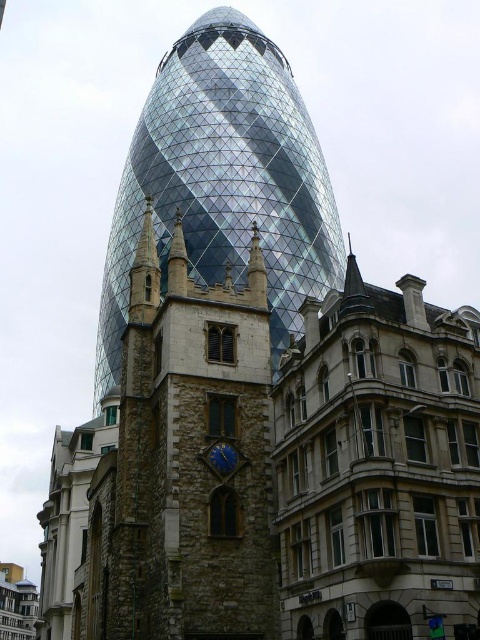
Find the location of a particular element. The height and width of the screenshot is (640, 480). stone clock tower at center-left is located at coordinates (192, 456).

Can you confirm if stone clock tower at center-left is wider than blue stone clock at center?

Yes, stone clock tower at center-left is wider than blue stone clock at center.

Does point (110, 579) lie in front of point (216, 458)?

Yes, it is in front of point (216, 458).

Locate an element on the screen. The width and height of the screenshot is (480, 640). stone clock tower at center-left is located at coordinates (192, 456).

Does stone clock tower at center have a smaller size compared to blue stone clock at center?

No, stone clock tower at center is not smaller than blue stone clock at center.

Can you confirm if stone clock tower at center is positioned below blue stone clock at center?

No, stone clock tower at center is not below blue stone clock at center.

You are a GUI agent. You are given a task and a screenshot of the screen. Output one action in this format:
    pyautogui.click(x=<x>, y=<y>)
    Task: Click on the stone clock tower at center
    The height and width of the screenshot is (640, 480).
    Given the screenshot: What is the action you would take?
    pyautogui.click(x=224, y=179)

Identify the location of stone clock tower at center. (224, 179).

Does stone clock tower at center-left have a lesser height compared to stone clock tower at center?

Yes.

Which of these two, stone clock tower at center-left or stone clock tower at center, stands shorter?

With less height is stone clock tower at center-left.

Where is `stone clock tower at center-left`? This screenshot has width=480, height=640. stone clock tower at center-left is located at coordinates (192, 456).